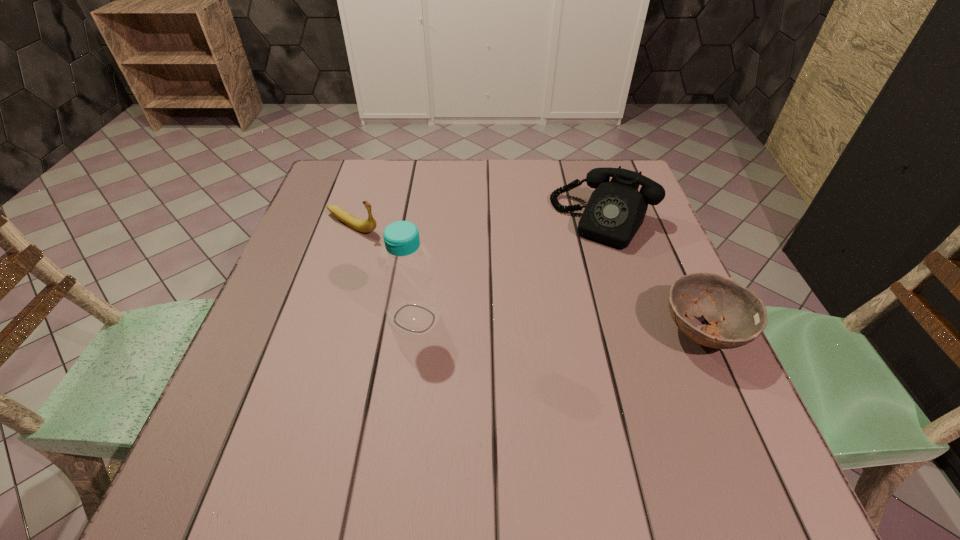
At what (x,y) coordinates should I click in order to perform the action: click on the tallest object. Please return your answer as a coordinate pair (x, y). This screenshot has height=540, width=960. Looking at the image, I should click on (411, 296).

Where is `bottle`? bottle is located at coordinates (411, 296).

Where is `the shortest object`? Image resolution: width=960 pixels, height=540 pixels. the shortest object is located at coordinates (736, 316).

Locate an element on the screen. the leftmost object is located at coordinates (368, 225).

This screenshot has width=960, height=540. What are the coordinates of `banana` in the screenshot? It's located at (368, 225).

Where is `telephone`? telephone is located at coordinates (615, 211).

The width and height of the screenshot is (960, 540). Identify the location of vacant space located on the right of the tallest object. (542, 318).

Where is `vacant space situated 0.060m on the back of the bowl`? vacant space situated 0.060m on the back of the bowl is located at coordinates (680, 280).

Identify the location of vacant space located at the stem of the second shortest object. (488, 291).

This screenshot has height=540, width=960. Find the location of `vacant area located at the stem of the second shortest object`. vacant area located at the stem of the second shortest object is located at coordinates (422, 258).